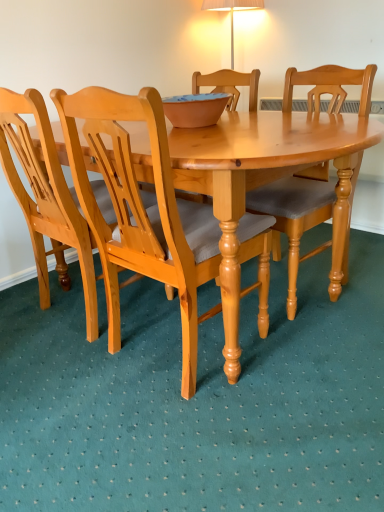
Question: Is the depth of matte clay bowl at center less than that of light brown wood chair at center, the second chair in the left-to-right sequence?

Choices:
 (A) yes
 (B) no

Answer: (B)

Question: Does matte clay bowl at center have a lesser width compared to light brown wood chair at center, which is the 2th chair from right to left?

Choices:
 (A) no
 (B) yes

Answer: (B)

Question: From the image's perspective, would you say matte clay bowl at center is positioned over light brown wood chair at center, the second chair in the left-to-right sequence?

Choices:
 (A) yes
 (B) no

Answer: (A)

Question: Are matte clay bowl at center and light brown wood chair at center, the second chair in the left-to-right sequence, located far from each other?

Choices:
 (A) yes
 (B) no

Answer: (B)

Question: From a real-world perspective, is matte clay bowl at center under light brown wood chair at center, which is the 2th chair from right to left?

Choices:
 (A) no
 (B) yes

Answer: (A)

Question: Considering the relative sizes of matte clay bowl at center and light brown wood chair at center, which is the 2th chair from right to left, in the image provided, is matte clay bowl at center wider than light brown wood chair at center, which is the 2th chair from right to left,?

Choices:
 (A) yes
 (B) no

Answer: (B)

Question: Is light brown wood chair at left, placed as the 3th chair when sorted from right to left, smaller than matte clay bowl at center?

Choices:
 (A) yes
 (B) no

Answer: (B)

Question: Is light brown wood chair at left, placed as the 3th chair when sorted from right to left, at the right side of matte clay bowl at center?

Choices:
 (A) yes
 (B) no

Answer: (B)

Question: Is matte clay bowl at center at the back of light brown wood chair at left, the first chair in the left-to-right sequence?

Choices:
 (A) yes
 (B) no

Answer: (B)

Question: Is light brown wood chair at left, the first chair in the left-to-right sequence, not inside matte clay bowl at center?

Choices:
 (A) no
 (B) yes

Answer: (B)

Question: Can you confirm if light brown wood chair at left, the first chair in the left-to-right sequence, is wider than matte clay bowl at center?

Choices:
 (A) no
 (B) yes

Answer: (B)

Question: Does light brown wood chair at left, placed as the 3th chair when sorted from right to left, lie in front of matte clay bowl at center?

Choices:
 (A) yes
 (B) no

Answer: (A)

Question: From the image's perspective, is light brown wood chair at center, the second chair in the left-to-right sequence, beneath light brown wood chair at left, the first chair in the left-to-right sequence?

Choices:
 (A) no
 (B) yes

Answer: (B)